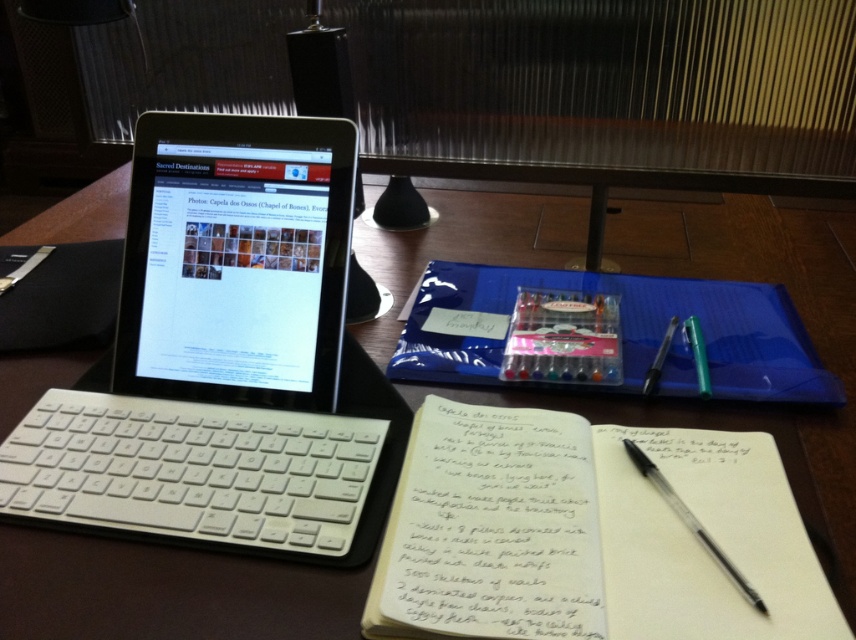
You are organizing your desk and need to place both the white paper notebook at center and the black plastic pen at lower right into a drawer. The drawer has a maximum capacity of 15 cm in height. Which item will not fit if the notebook measures 16 cm tall?

The white paper notebook at center measures 16 cm in height, which exceeds the drawer height limit of 15 cm, so it will not fit.

Based on the photo, you are organizing your desk and need to place a new item exactly where the white paper notebook at center is currently located. Based on the coordinates provided, can you describe the notebook position in terms of its horizontal and vertical placement relative to the desk?

The white paper notebook at center is positioned at coordinates 0.836 horizontally and 0.688 vertically on the desk. This means it is located approximately 83.6 percent from the left edge and 68.8 percent from the bottom edge of the desk surface.